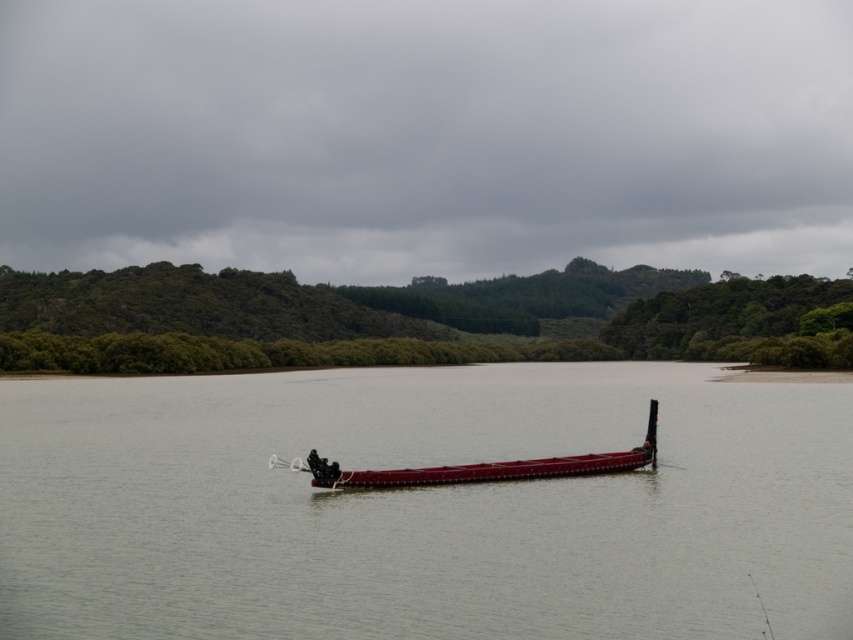
From the picture: You are standing on the shore of the lake and see the point marked at coordinates (424, 506). Based on the scene description, what is the surface condition of the water at that point?

The point at (424, 506) is on smooth water at center, so the surface condition is smooth.

You are an observer standing on the shore looking at the scene. Which object is higher in the image, the smooth water at center or the shiny red canoe at center?

The smooth water at center is taller than the shiny red canoe at center.

You are a kayaker planning to cross the water in the image. The smooth water at center is calm and the shiny red canoe at center is anchored. Can you safely navigate your kayak between them?

The distance between the smooth water at center and the shiny red canoe at center is 105.53 feet, so yes, you can safely navigate your kayak between them as there is sufficient space.